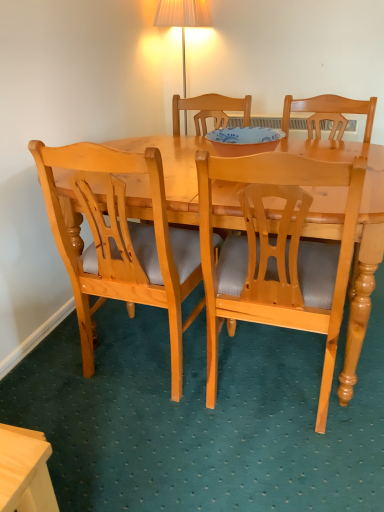
Identify the location of vacant area in front of light brown wood chair at left, the 2th chair in the right-to-left sequence. This screenshot has height=512, width=384. (158, 449).